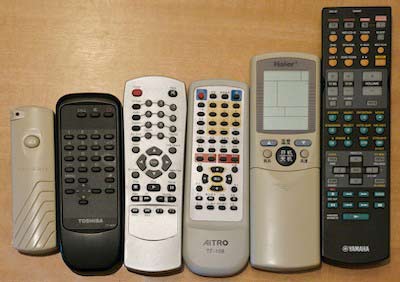
Image resolution: width=400 pixels, height=282 pixels. Find the location of `table`. table is located at coordinates (121, 52).